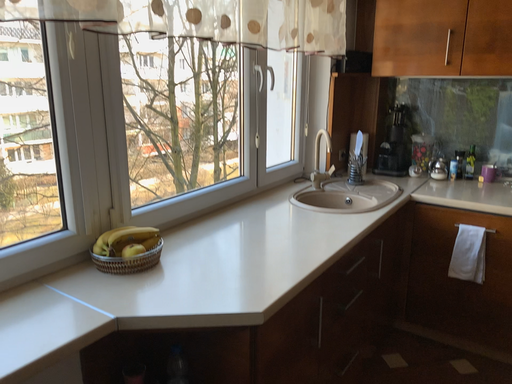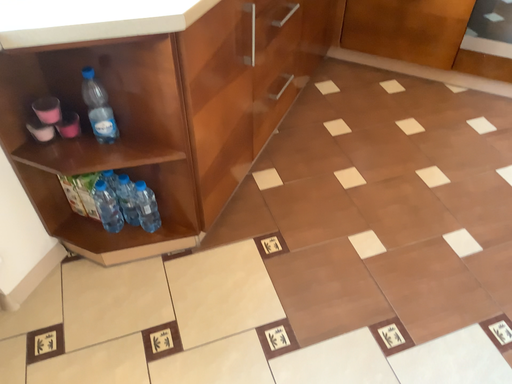
Question: Which way did the camera rotate in the video?

Choices:
 (A) rotated left
 (B) rotated right

Answer: (B)